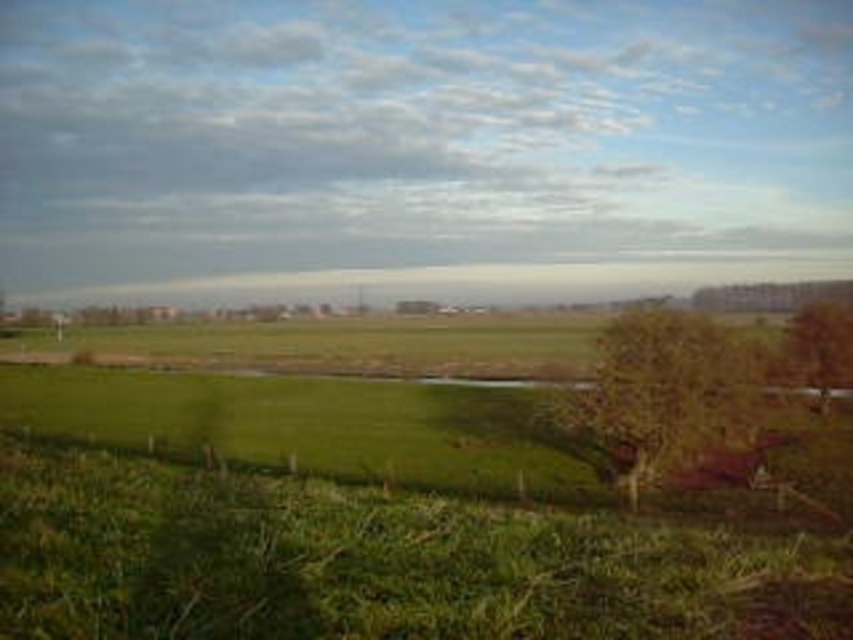
Does brown textured tree at center right have a larger size compared to brown textured tree at right?

Indeed, brown textured tree at center right has a larger size compared to brown textured tree at right.

Does point (724, 349) come farther from viewer compared to point (840, 360)?

No, (724, 349) is closer to viewer.

Does point (708, 440) come closer to viewer compared to point (836, 380)?

Yes, it is.

Find the location of a particular element. The image size is (853, 640). brown textured tree at center right is located at coordinates (665, 394).